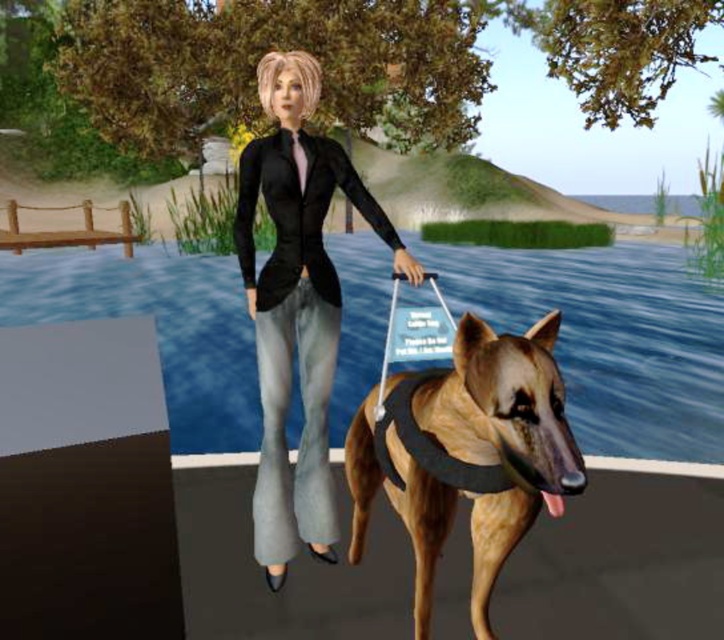
You are a character in a video game and need to move from point A to point B. The coordinates of point A are point (286, 132) and point B are point (425, 566). Which point is closer to you?

Point (286, 132) is closer to you than point (425, 566) because it is further to the viewer.